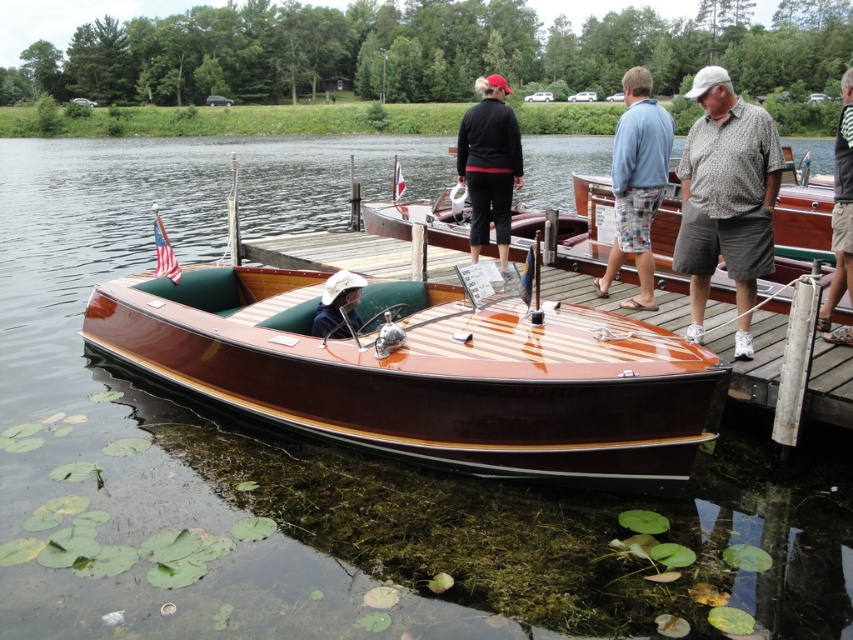
Question: Which of the following is the closest to the observer?

Choices:
 (A) gray striped shirt at right
 (B) black matte jacket at upper center

Answer: (A)

Question: Does glossy wood dock at center have a smaller size compared to white cloth hat at center?

Choices:
 (A) no
 (B) yes

Answer: (A)

Question: Which object appears closest to the camera in this image?

Choices:
 (A) white cloth hat at center
 (B) gray striped shirt at right
 (C) printed cotton shirt at right

Answer: (B)

Question: Which point appears farthest from the camera in this image?

Choices:
 (A) (740, 214)
 (B) (498, 216)

Answer: (B)

Question: Does printed cotton shirt at right appear under black matte jacket at upper center?

Choices:
 (A) no
 (B) yes

Answer: (B)

Question: Can you confirm if printed cotton shirt at right is bigger than black matte jacket at upper center?

Choices:
 (A) no
 (B) yes

Answer: (A)